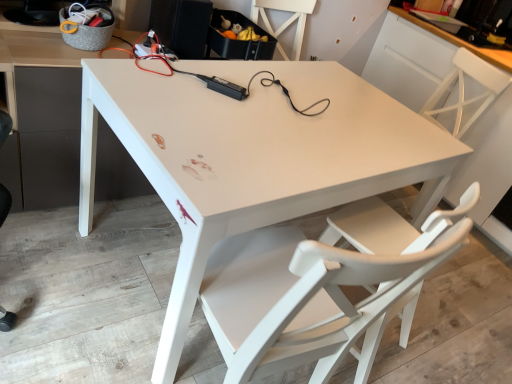
Question: In the image, is white matte chair at lower right, the 1th chair when ordered from front to back, positioned in front of or behind white matte chair at upper right, the 2th chair when ordered from front to back?

Choices:
 (A) front
 (B) behind

Answer: (A)

Question: In terms of width, does white matte chair at lower right, which is the first chair in left-to-right order, look wider or thinner when compared to white matte chair at upper right, which is the 1th chair in right-to-left order?

Choices:
 (A) thin
 (B) wide

Answer: (A)

Question: Estimate the real-world distances between objects in this image. Which object is farther from the white matte chair at lower right, the 2th chair viewed from the right?

Choices:
 (A) white glossy table at center
 (B) white matte chair at upper right, marked as the 2th chair in a left-to-right arrangement

Answer: (B)

Question: Estimate the real-world distances between objects in this image. Which object is closer to the white matte chair at lower right, the 1th chair when ordered from front to back?

Choices:
 (A) white glossy table at center
 (B) white matte chair at upper right, marked as the 1th chair in a back-to-front arrangement

Answer: (A)